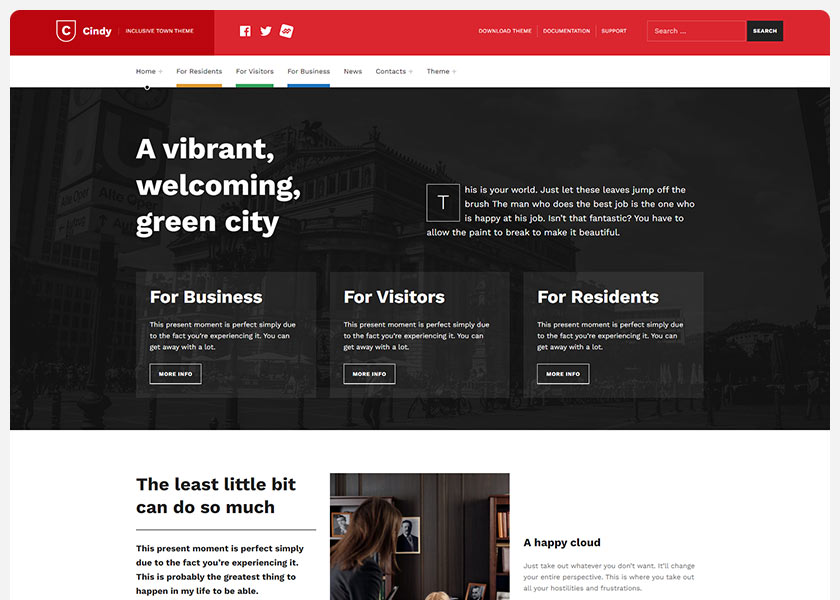
Image resolution: width=840 pixels, height=600 pixels. Find the location of `picter frame`. picter frame is located at coordinates (408, 534).